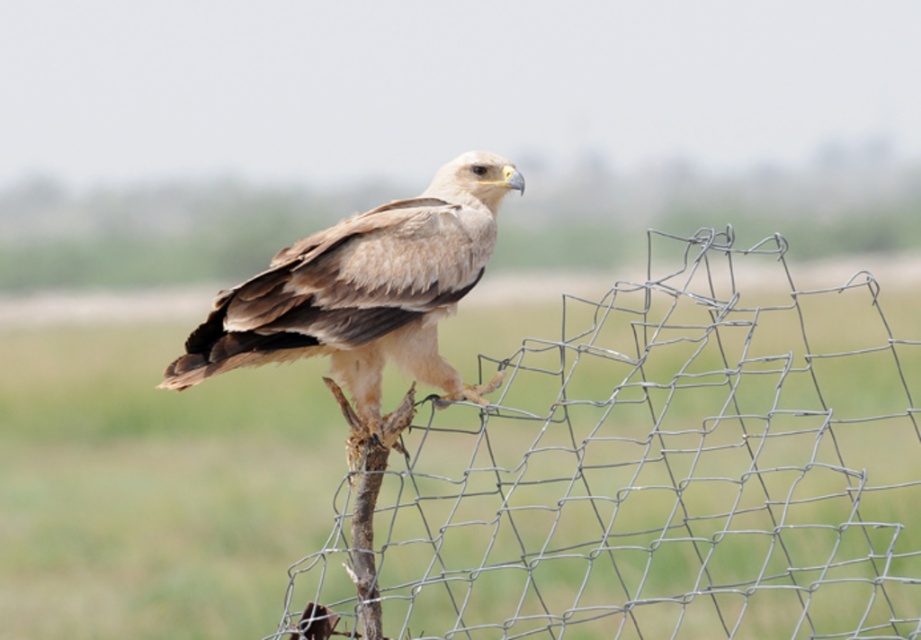
Question: Which point is farther from the camera taking this photo?

Choices:
 (A) (888, 545)
 (B) (446, 266)

Answer: (A)

Question: Is wire mesh fence at center closer to camera compared to light brown feathered eagle at center?

Choices:
 (A) no
 (B) yes

Answer: (B)

Question: Is wire mesh fence at center further to the viewer compared to light brown feathered eagle at center?

Choices:
 (A) yes
 (B) no

Answer: (B)

Question: Is wire mesh fence at center above light brown feathered eagle at center?

Choices:
 (A) no
 (B) yes

Answer: (A)

Question: Which of the following is the farthest from the observer?

Choices:
 (A) light brown feathered eagle at center
 (B) wire mesh fence at center

Answer: (A)